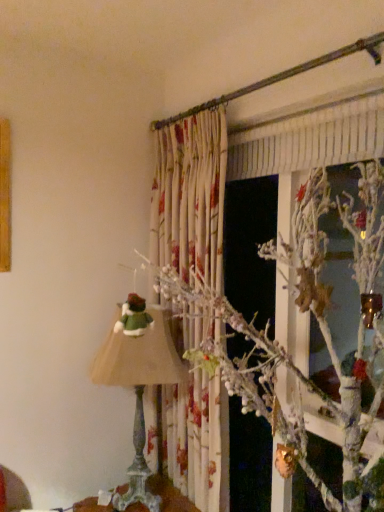
Question: Would you say matte green fabric lampshade at left is inside or outside white frosted branch at upper center?

Choices:
 (A) inside
 (B) outside

Answer: (B)

Question: Relative to white frosted branch at upper center, is matte green fabric lampshade at left in front or behind?

Choices:
 (A) front
 (B) behind

Answer: (B)

Question: Which is farther from the wooden table at lower center?

Choices:
 (A) matte green fabric lampshade at left
 (B) white frosted branch at upper center

Answer: (B)

Question: Which is nearer to the white frosted branch at upper center?

Choices:
 (A) matte green fabric lampshade at left
 (B) wooden table at lower center

Answer: (A)